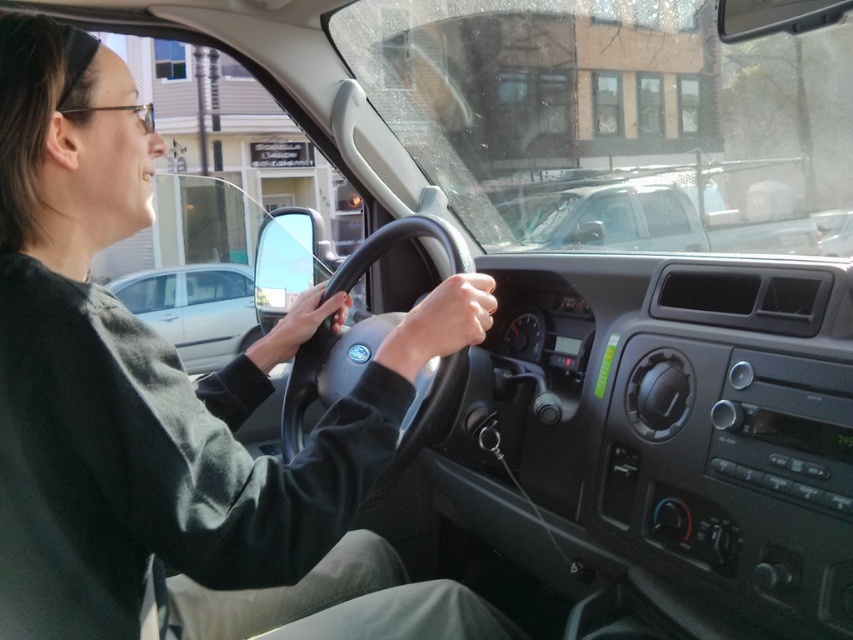
Can you confirm if transparent glass windshield at upper center is positioned to the left of silver metallic sedan at center?

Incorrect, transparent glass windshield at upper center is not on the left side of silver metallic sedan at center.

Does transparent glass windshield at upper center have a lesser width compared to silver metallic sedan at center?

Incorrect, transparent glass windshield at upper center's width is not less than silver metallic sedan at center's.

Which is in front, point (486, 109) or point (171, 298)?

Point (171, 298) is more forward.

Image resolution: width=853 pixels, height=640 pixels. I want to click on transparent glass windshield at upper center, so click(614, 122).

Is black rubber steering wheel at center wider than silver metallic sedan at center?

No, black rubber steering wheel at center is not wider than silver metallic sedan at center.

Between black rubber steering wheel at center and silver metallic sedan at center, which one is positioned lower?

silver metallic sedan at center is lower down.

The height and width of the screenshot is (640, 853). Describe the element at coordinates (328, 371) in the screenshot. I see `black rubber steering wheel at center` at that location.

Find the location of `black rubber steering wheel at center`. black rubber steering wheel at center is located at coordinates (328, 371).

Is point (567, 93) in front of point (408, 234)?

No, (567, 93) is behind (408, 234).

Describe the element at coordinates (614, 122) in the screenshot. I see `transparent glass windshield at upper center` at that location.

Measure the distance between transparent glass windshield at upper center and camera.

transparent glass windshield at upper center is 6.93 meters away from camera.

This screenshot has width=853, height=640. I want to click on transparent glass windshield at upper center, so click(x=614, y=122).